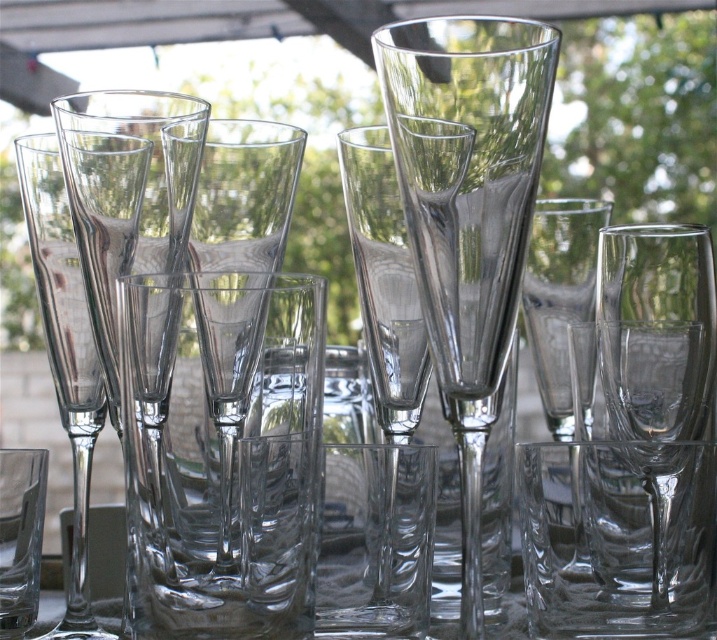
You are setting up a table for a party and have two glasses in front of you. You need to place the wider one on the right side of the table. Which of the two glasses should you choose between the transparent glass vase at center and the transparent glass flute at left?

The transparent glass vase at center is wider than the transparent glass flute at left, so you should choose the transparent glass vase at center to place on the right side of the table.

Looking at this image, you are setting up a table for a party and need to place a centerpiece exactly at coordinates 0.6, 0.9. Is the transparent glass wine glass at center currently occupying that spot?

The transparent glass wine glass at center is positioned at point (660, 380), which is very close to the desired coordinates of (645, 384). Since the coordinates are nearly identical, the glass is occupying that spot.